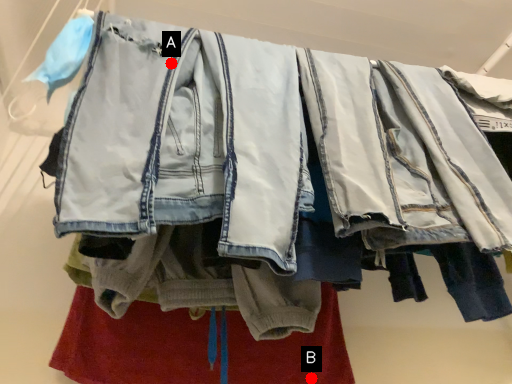
Question: Two points are circled on the image, labeled by A and B beside each circle. Which point is closer to the camera taking this photo?

Choices:
 (A) A is closer
 (B) B is closer

Answer: (A)